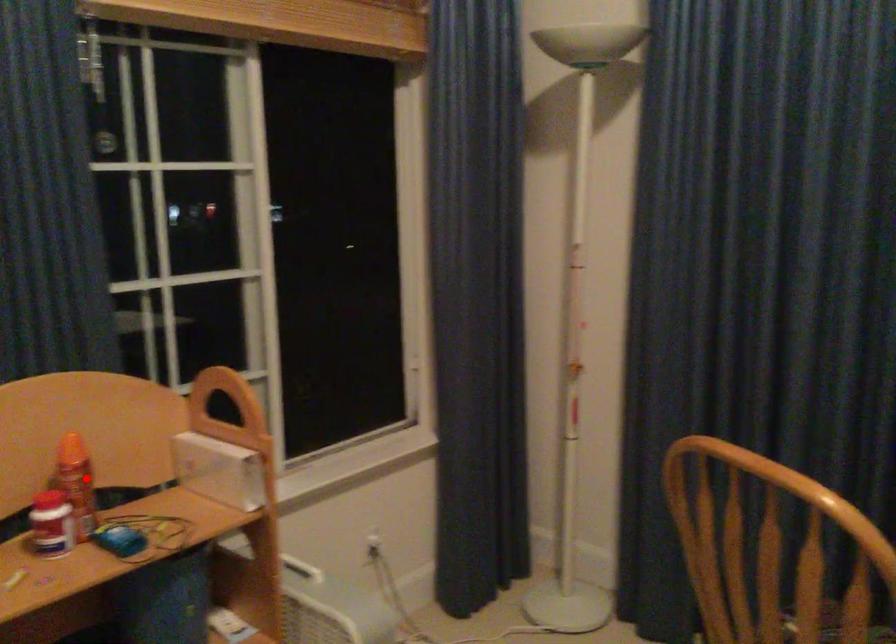
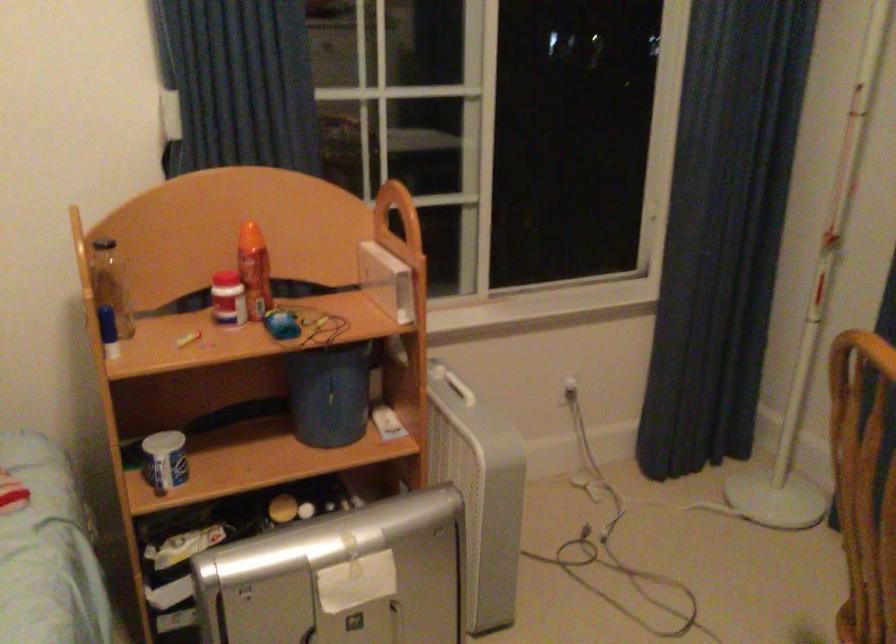
Question: A red point is marked in image1. In image2, is the corresponding 3D point closer to the camera or farther? Reply with the corresponding letter.

Choices:
 (A) The corresponding 3D point is closer.
 (B) The corresponding 3D point is farther.

Answer: (B)